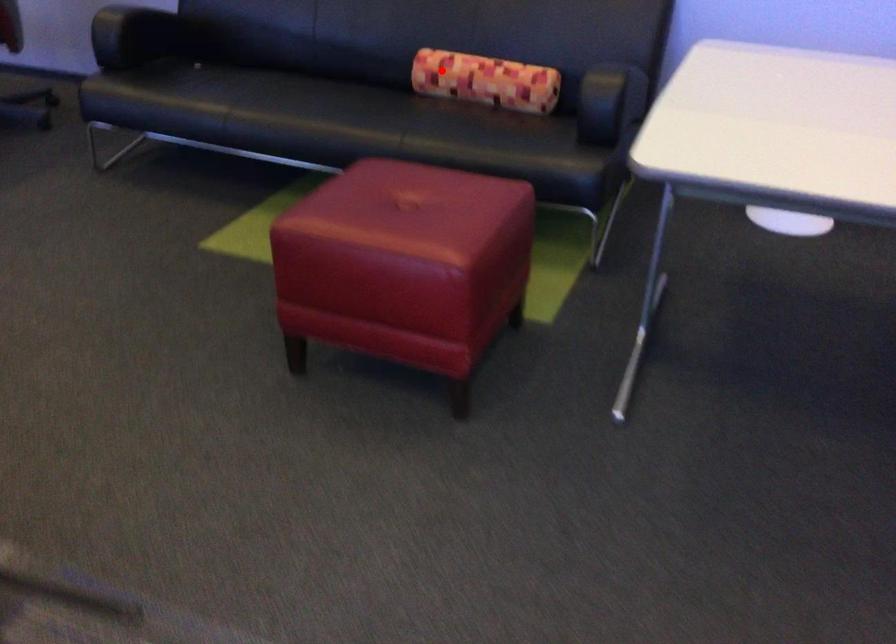
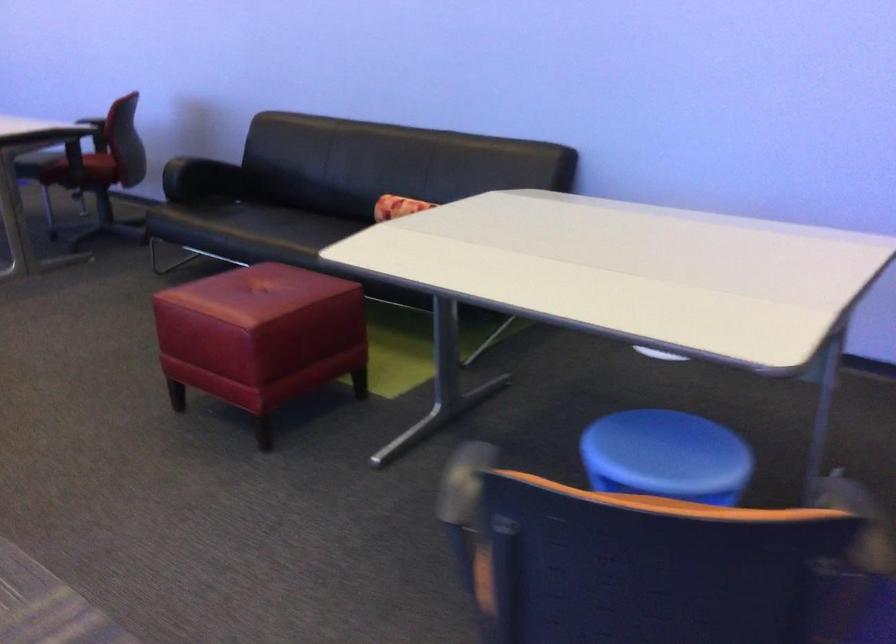
Question: I am providing you with two images of the same scene from different viewpoints. In image1, a red point is highlighted. Considering the same 3D point in image2, which of the following is correct?

Choices:
 (A) It is closer
 (B) It is farther

Answer: (B)